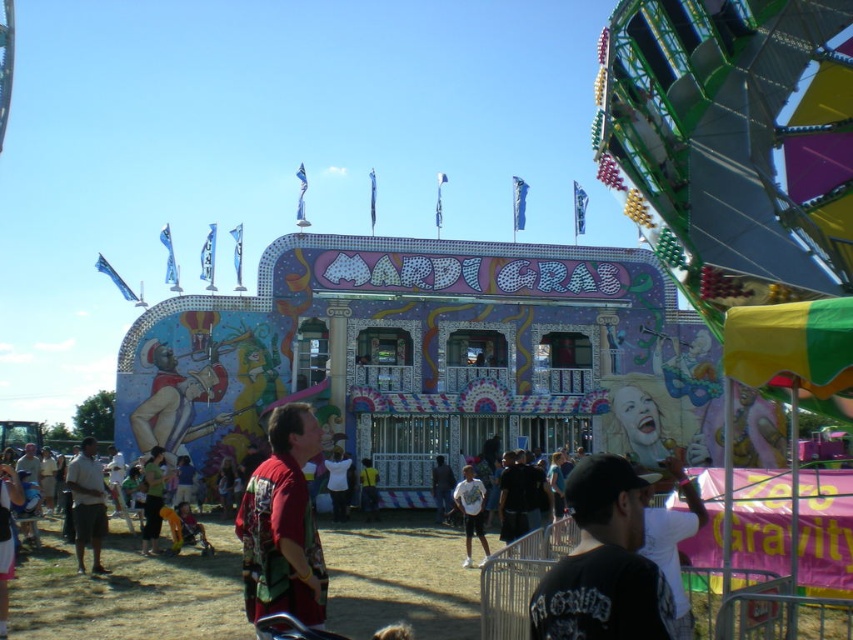
Is black t-shirt at lower right to the left of white matte shirt at center from the viewer's perspective?

No, black t-shirt at lower right is not to the left of white matte shirt at center.

Between point (599, 572) and point (471, 528), which one is positioned behind?

The point (471, 528) is more distant.

Identify the location of black t-shirt at lower right. (602, 563).

Between white matte shirt at center and green fabric dress at center, which one appears on the right side from the viewer's perspective?

white matte shirt at center is more to the right.

Locate an element on the screen. white matte shirt at center is located at coordinates (471, 512).

Identify the location of white matte shirt at center. (471, 512).

Does green fabric dress at center have a smaller size compared to yellow fabric at center?

Actually, green fabric dress at center might be larger than yellow fabric at center.

Does point (151, 476) come behind point (364, 484)?

No, it is in front of (364, 484).

Which is in front, point (157, 486) or point (361, 493)?

Point (157, 486)

The height and width of the screenshot is (640, 853). In order to click on green fabric dress at center in this screenshot , I will do `click(152, 499)`.